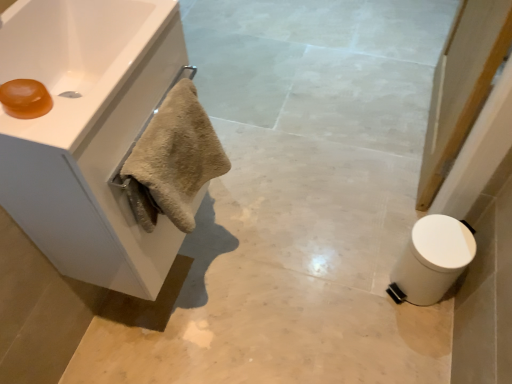
This screenshot has height=384, width=512. In order to click on vacant space to the left of white matte trash can at lower right in this screenshot , I will do `click(353, 287)`.